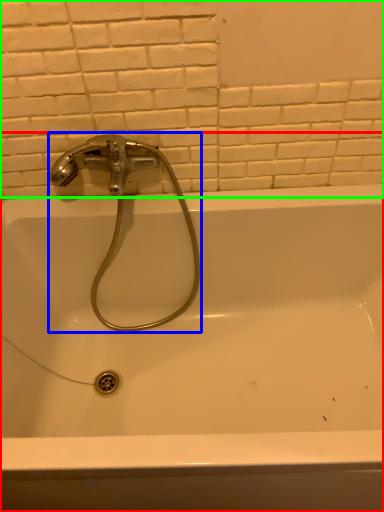
Question: Considering the real-world distances, which object is closest to bathtub (highlighted by a red box)? tap (highlighted by a blue box) or ceramic tile (highlighted by a green box).

Choices:
 (A) tap
 (B) ceramic tile

Answer: (A)